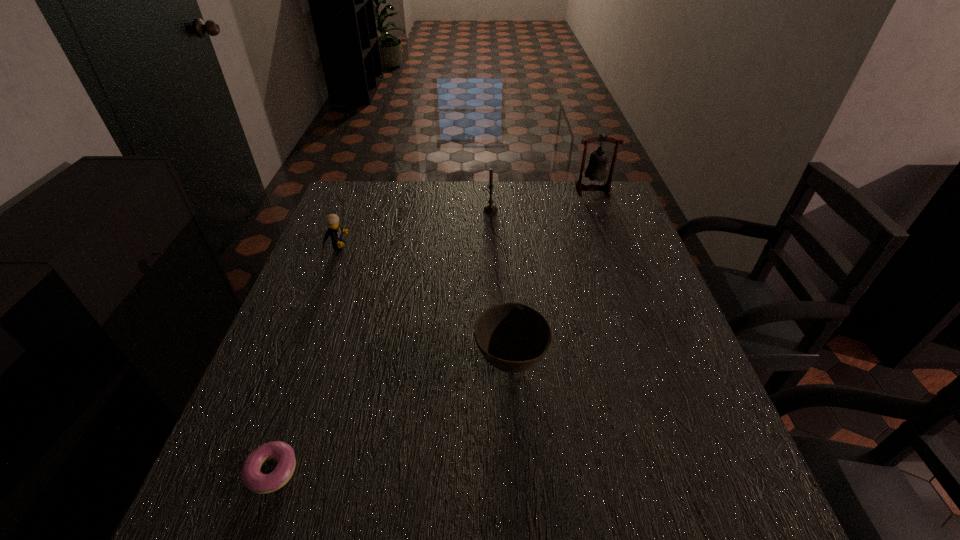
Where is `free spot that satisfies the following two spatial constraints: 1. on the front-facing side of the third nearest object; 2. on the right side of the bowl`? free spot that satisfies the following two spatial constraints: 1. on the front-facing side of the third nearest object; 2. on the right side of the bowl is located at coordinates (292, 362).

Identify the location of free space in the image that satisfies the following two spatial constraints: 1. on the front-facing side of the fourth farthest object; 2. on the right side of the Lego. This screenshot has width=960, height=540. (292, 362).

At what (x,y) coordinates should I click in order to perform the action: click on free location that satisfies the following two spatial constraints: 1. on the front side of the fourth nearest object; 2. on the right side of the bowl. Please return your answer as a coordinate pair (x, y). The width and height of the screenshot is (960, 540). Looking at the image, I should click on (495, 362).

Locate an element on the screen. The width and height of the screenshot is (960, 540). vacant area in the image that satisfies the following two spatial constraints: 1. on the front-facing side of the fourth farthest object; 2. on the right side of the third farthest object is located at coordinates click(x=292, y=362).

Where is `vacant space that satisfies the following two spatial constraints: 1. on the front-facing side of the Lego; 2. on the right side of the second nearest object`? This screenshot has width=960, height=540. vacant space that satisfies the following two spatial constraints: 1. on the front-facing side of the Lego; 2. on the right side of the second nearest object is located at coordinates (292, 362).

The height and width of the screenshot is (540, 960). Identify the location of vacant area that satisfies the following two spatial constraints: 1. on the front side of the fourth nearest object; 2. on the front-facing side of the third nearest object. (492, 246).